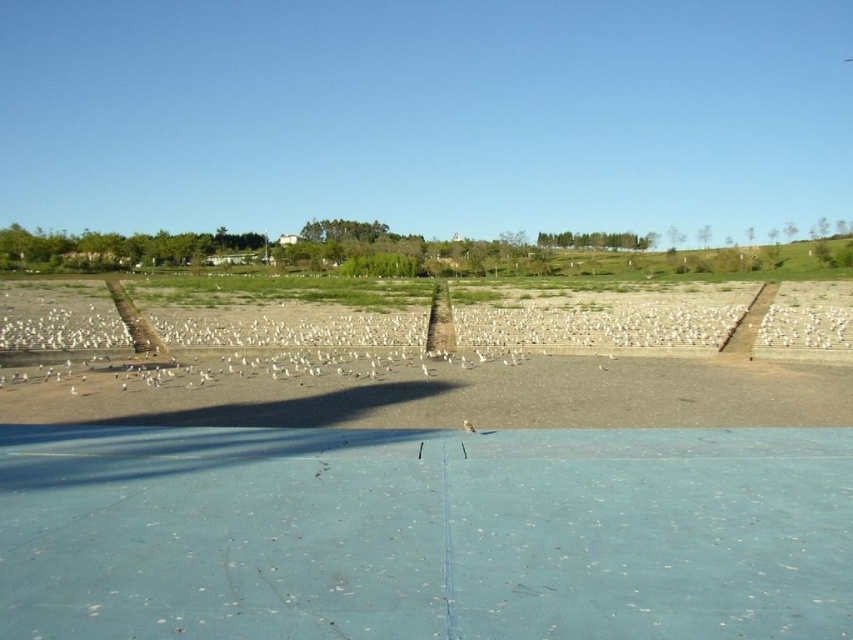
Question: Which point appears closest to the camera in this image?

Choices:
 (A) (466, 429)
 (B) (651, 340)

Answer: (A)

Question: Can you confirm if brown sandy dirt at center is smaller than brown feathered bird at center?

Choices:
 (A) yes
 (B) no

Answer: (B)

Question: Is brown sandy dirt at center wider than brown feathered bird at center?

Choices:
 (A) yes
 (B) no

Answer: (A)

Question: Which object appears closest to the camera in this image?

Choices:
 (A) brown feathered bird at center
 (B) brown sandy dirt at center

Answer: (A)

Question: Is the position of brown sandy dirt at center less distant than that of brown feathered bird at center?

Choices:
 (A) no
 (B) yes

Answer: (A)